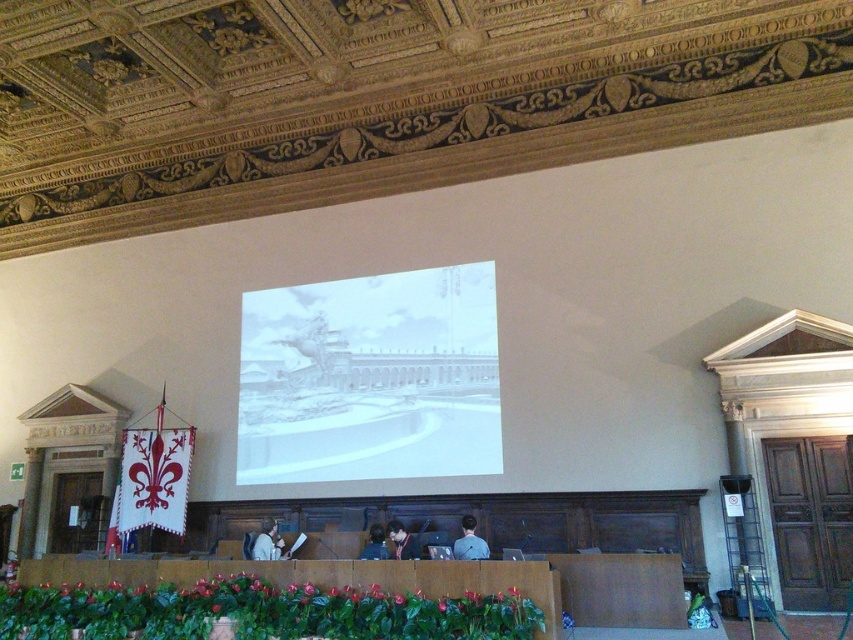
Question: Can you confirm if light brown leather jacket at lower center is positioned below dark blue fabric at center?

Choices:
 (A) no
 (B) yes

Answer: (B)

Question: Which object is closer to the camera taking this photo?

Choices:
 (A) gray fabric shirt at center
 (B) light brown leather jacket at lower center
 (C) matte black laptop at center

Answer: (A)

Question: Which point is farther to the camera?

Choices:
 (A) dark blue fabric at center
 (B) matte black laptop at center
 (C) gray fabric shirt at center
 (D) light brown leather jacket at lower center

Answer: (D)

Question: Which object is the closest to the dark blue fabric at center?

Choices:
 (A) matte black laptop at center
 (B) light brown leather jacket at lower center
 (C) white paper at center

Answer: (A)

Question: Does matte black laptop at center have a smaller size compared to dark blue fabric at center?

Choices:
 (A) no
 (B) yes

Answer: (A)

Question: Is gray fabric shirt at center behind matte black laptop at center?

Choices:
 (A) no
 (B) yes

Answer: (A)